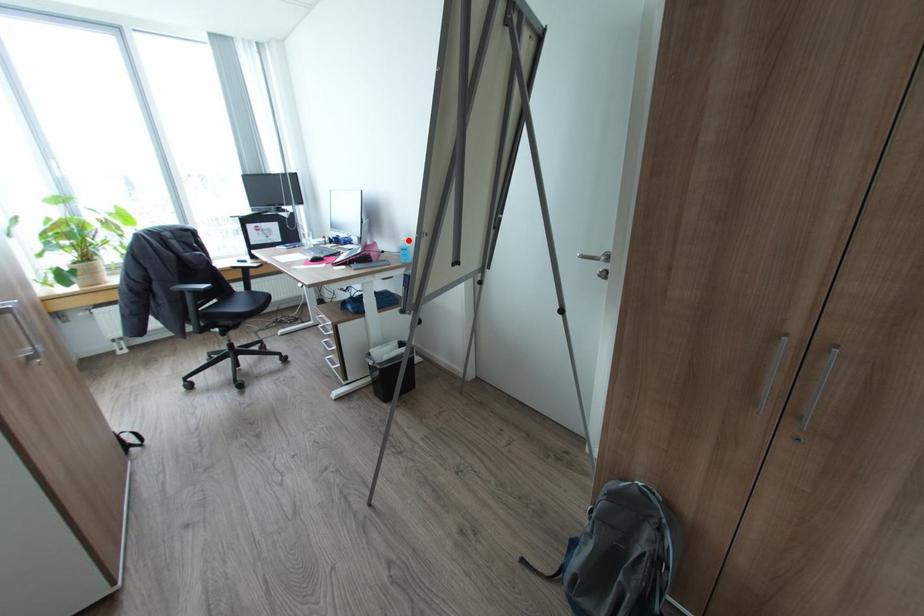
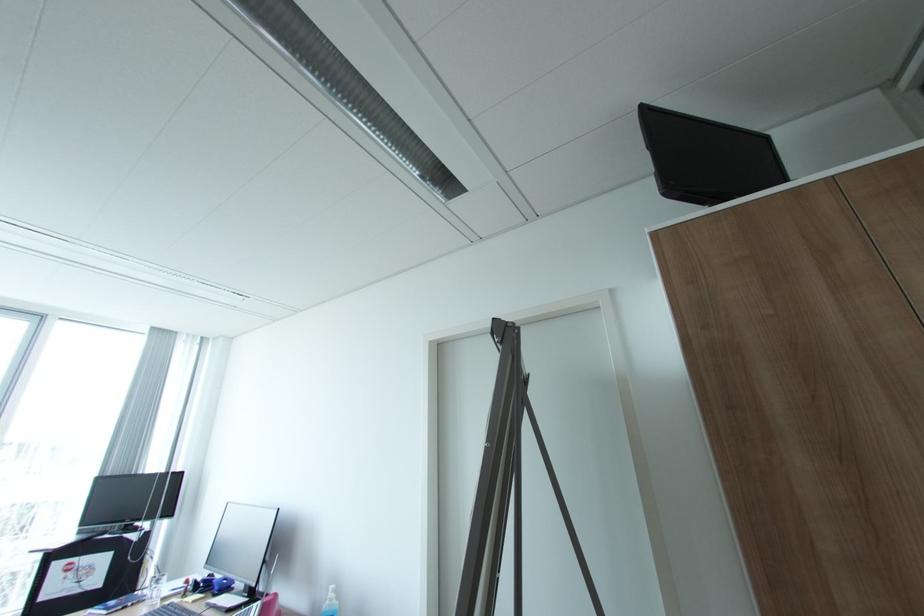
Where in the second image is the point corresponding to the highlighted location from the first image?

(336, 599)